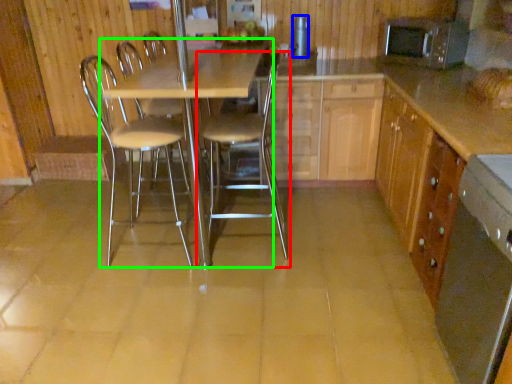
Question: Which object is positioned closest to chair (highlighted by a red box)? Select from appliance (highlighted by a blue box) and table (highlighted by a green box).

Choices:
 (A) appliance
 (B) table

Answer: (B)